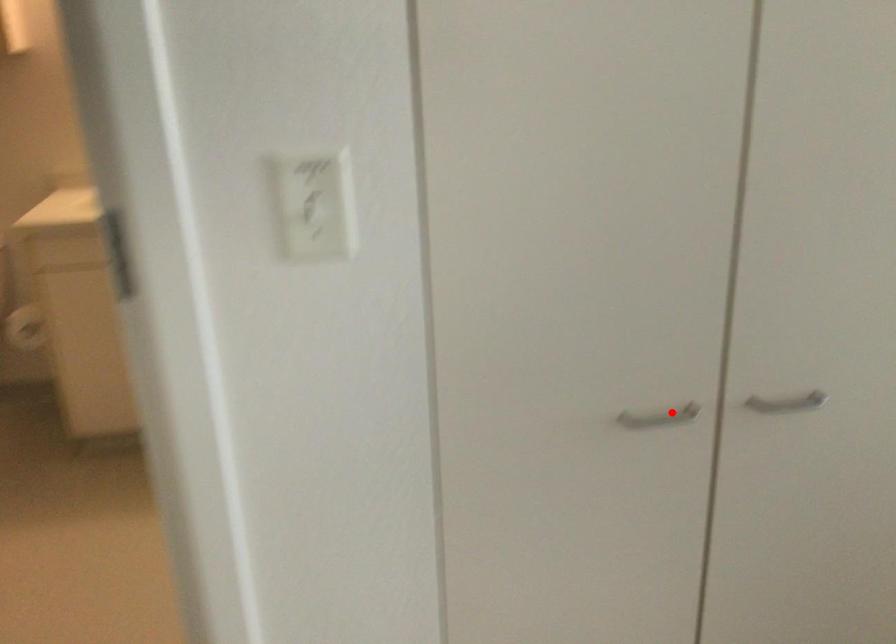
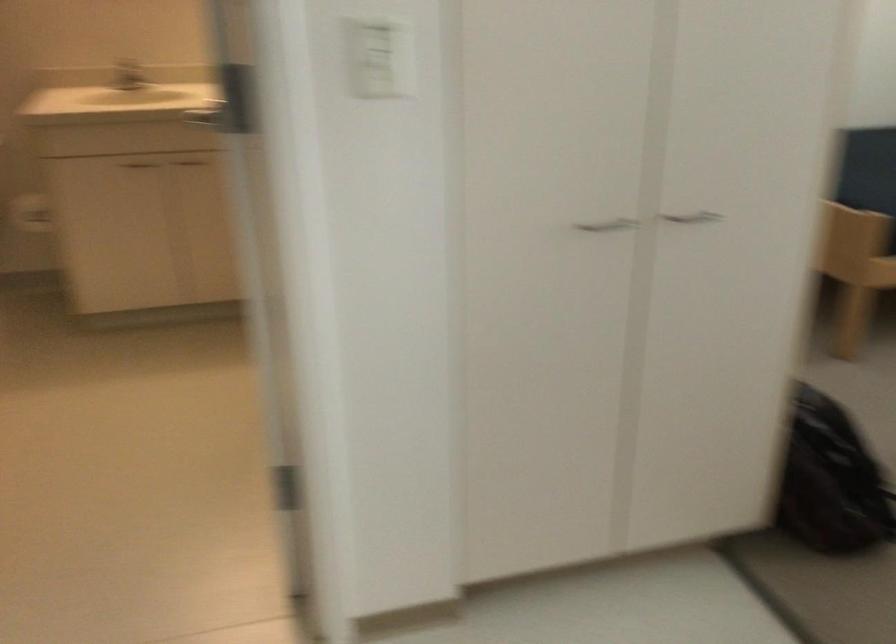
Question: I am providing you with two images of the same scene from different viewpoints. Given a red point in image1, look at the same physical point in image2. Is it:

Choices:
 (A) Closer to the viewpoint
 (B) Farther from the viewpoint

Answer: (B)